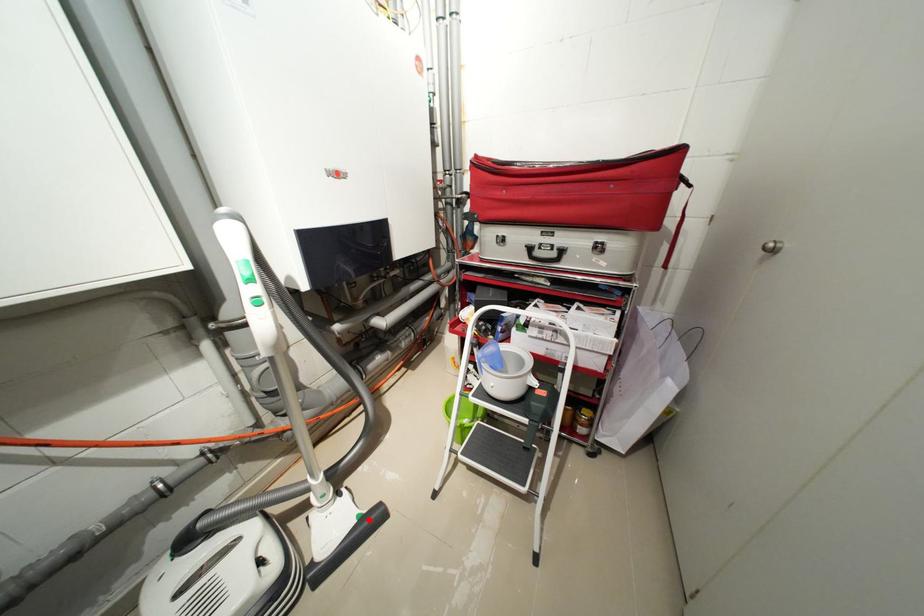
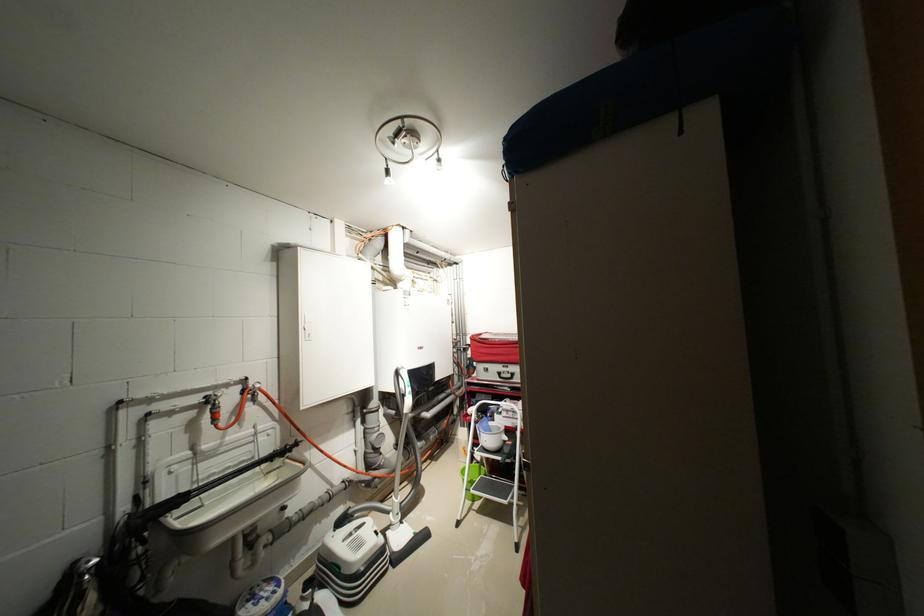
Locate, in the second image, the point that corresponds to the highlighted location in the first image.

(423, 536)